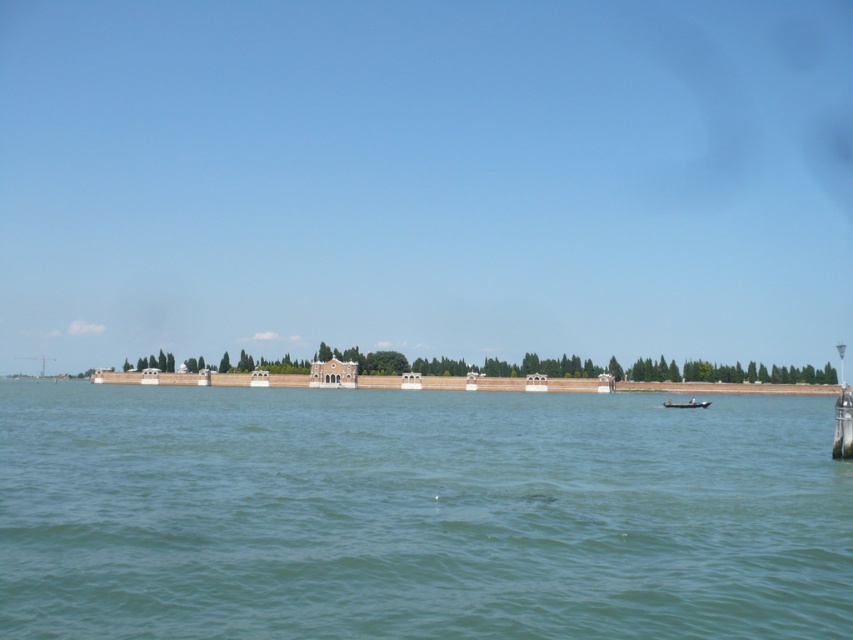
Question: Based on their relative distances, which object is nearer to the green water at center?

Choices:
 (A) wooden boat at lower right
 (B) white stone wall at center

Answer: (A)

Question: Is green water at center closer to the viewer compared to wooden boat at lower right?

Choices:
 (A) no
 (B) yes

Answer: (B)

Question: Can you confirm if green water at center is positioned above wooden boat at lower right?

Choices:
 (A) no
 (B) yes

Answer: (B)

Question: Among these objects, which one is nearest to the camera?

Choices:
 (A) wooden boat at lower right
 (B) green water at center

Answer: (B)

Question: Does white stone wall at center lie behind wooden boat at lower right?

Choices:
 (A) yes
 (B) no

Answer: (A)

Question: Among these objects, which one is nearest to the camera?

Choices:
 (A) white stone wall at center
 (B) wooden boat at lower right

Answer: (B)